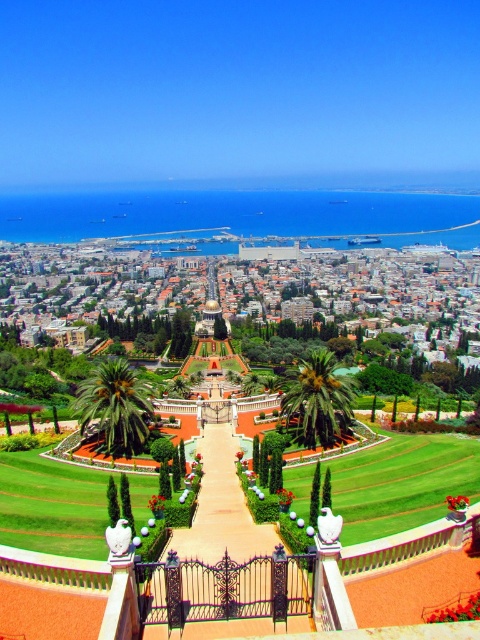
Wait, there seems to be a typo in the object labels. Both objects are labeled as green leafy palm tree at center and green leafy palm at center. Are these two distinct objects or duplicates? Please clarify the object labels to ensure they are unique and correctly described.

The objects listed are duplicates. Both are labeled as green leafy palm tree at center and green leafy palm at center, which likely refer to the same object. Please correct the object labels to avoid redundancy.

You are standing at the entrance of the garden and want to reach the grand structure with the golden dome. According to the image, where is the metallic gate at center located in relation to your starting position?

The metallic gate at center is located at point 0.794 on the x axis and 0.460 on the y axis, so it is positioned to the right and slightly forward from your starting position at the entrance.

You are standing at the entrance of the garden and see the metallic gate at center and the green leafy palm at center. Which object is positioned to the left when facing towards the garden?

The metallic gate at center is positioned to the left of the green leafy palm at center when facing towards the garden.